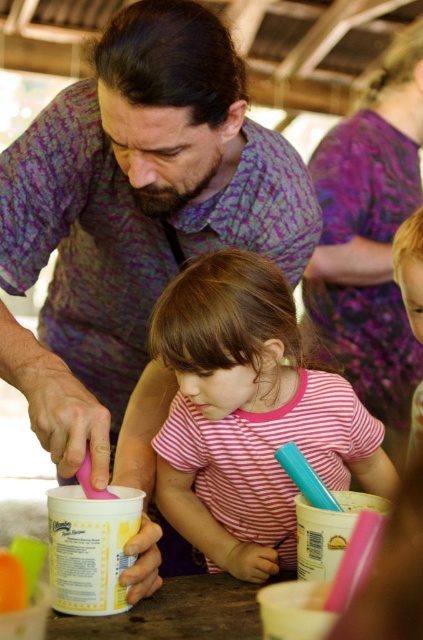
Question: Among these objects, which one is farthest from the camera?

Choices:
 (A) purple tie-dye shirt at center
 (B) pink striped shirt at center
 (C) purple batik shirt at upper center
 (D) blonde hair at upper right

Answer: (C)

Question: In this image, where is purple tie-dye shirt at center located relative to pink striped shirt at center?

Choices:
 (A) right
 (B) left

Answer: (B)

Question: Which point appears closest to the camera in this image?

Choices:
 (A) (140, 49)
 (B) (327, 243)

Answer: (A)

Question: Among these objects, which one is nearest to the camera?

Choices:
 (A) purple tie-dye shirt at center
 (B) pink striped shirt at center

Answer: (A)

Question: Can you confirm if purple tie-dye shirt at center is thinner than pink striped shirt at center?

Choices:
 (A) yes
 (B) no

Answer: (B)

Question: Does pink striped shirt at center have a larger size compared to blonde hair at upper right?

Choices:
 (A) no
 (B) yes

Answer: (B)